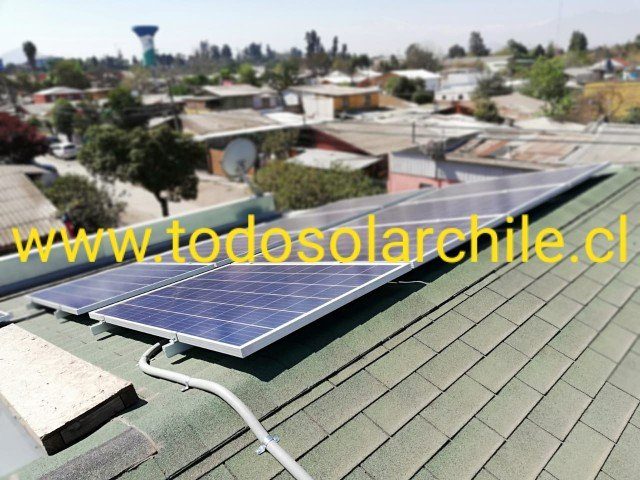
At what (x,y) coordinates should I click in order to perform the action: click on mounting bracket. Please return your answer as a coordinate pair (x, y). This screenshot has width=640, height=480. Looking at the image, I should click on (268, 441), (186, 384), (148, 360).